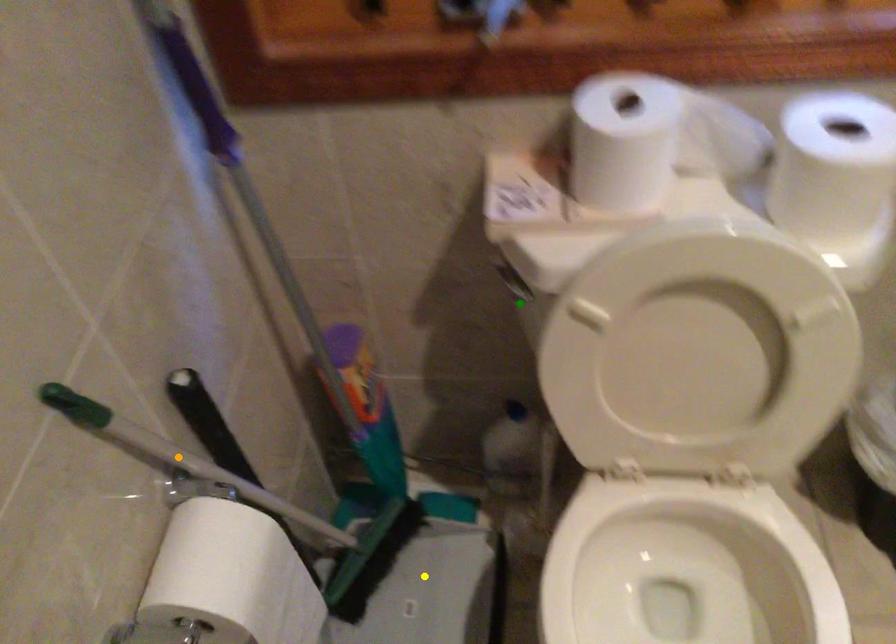
Order these from nearest to farthest:
- yellow point
- green point
- orange point

yellow point, green point, orange point